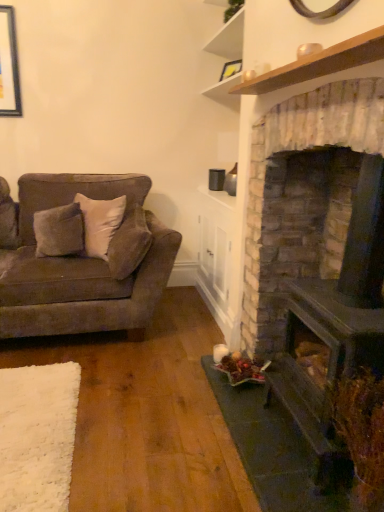
Question: Can you confirm if matte black picture frame at upper center is wider than suede-like brown couch at left?

Choices:
 (A) yes
 (B) no

Answer: (B)

Question: From a real-world perspective, is matte black picture frame at upper center physically above suede-like brown couch at left?

Choices:
 (A) no
 (B) yes

Answer: (B)

Question: From a real-world perspective, does matte black picture frame at upper center sit lower than suede-like brown couch at left?

Choices:
 (A) yes
 (B) no

Answer: (B)

Question: Is matte black picture frame at upper center to the right of suede-like brown couch at left from the viewer's perspective?

Choices:
 (A) no
 (B) yes

Answer: (B)

Question: Is matte black picture frame at upper center closer to camera compared to suede-like brown couch at left?

Choices:
 (A) no
 (B) yes

Answer: (A)

Question: Can you see matte black picture frame at upper center touching suede-like brown couch at left?

Choices:
 (A) yes
 (B) no

Answer: (B)

Question: From a real-world perspective, is matte black picture frame at upper center positioned under suede-like beige pillow at center-left based on gravity?

Choices:
 (A) no
 (B) yes

Answer: (A)

Question: Is matte black picture frame at upper center facing away from suede-like beige pillow at center-left?

Choices:
 (A) no
 (B) yes

Answer: (A)

Question: From the image's perspective, is matte black picture frame at upper center below suede-like beige pillow at center-left?

Choices:
 (A) yes
 (B) no

Answer: (B)

Question: Does matte black picture frame at upper center appear on the left side of suede-like beige pillow at center-left?

Choices:
 (A) no
 (B) yes

Answer: (A)

Question: Is matte black picture frame at upper center located outside suede-like beige pillow at center-left?

Choices:
 (A) no
 (B) yes

Answer: (B)

Question: Is the position of matte black picture frame at upper center more distant than that of suede-like beige pillow at center-left?

Choices:
 (A) yes
 (B) no

Answer: (A)

Question: Is suede-like brown couch at left a part of dark brown stone fireplace at right?

Choices:
 (A) yes
 (B) no

Answer: (B)